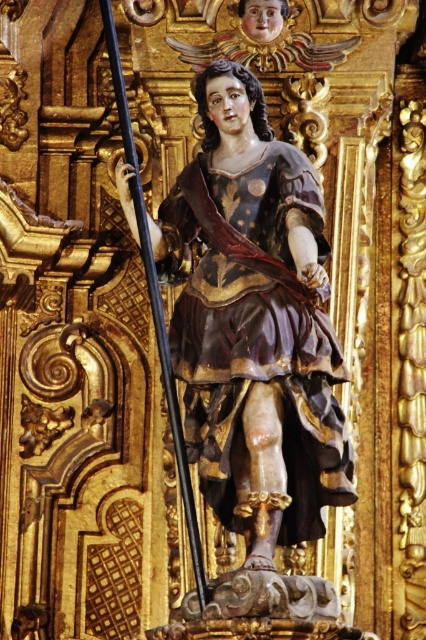
Does wooden statue at center have a greater height compared to black polished wood pole at center?

No.

Which is in front, point (317, 209) or point (192, 563)?

Positioned in front is point (317, 209).

Find the location of a particular element. This screenshot has width=426, height=640. wooden statue at center is located at coordinates (261, 332).